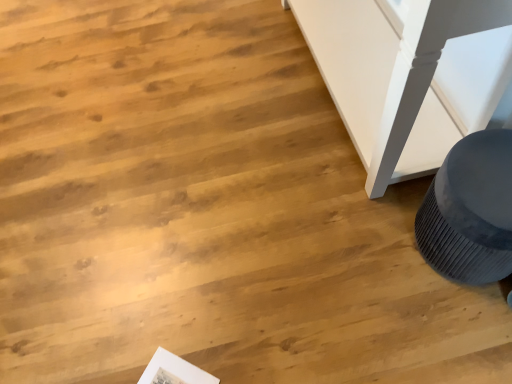
You are a GUI agent. You are given a task and a screenshot of the screen. Output one action in this format:
    pyautogui.click(x=<x>, y=<y>)
    Task: Click on the free point to the right of white paper at lower left
    The image size is (512, 384).
    Given the screenshot: What is the action you would take?
    pyautogui.click(x=247, y=352)